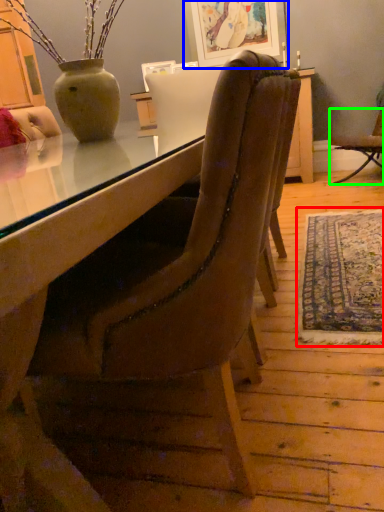
Question: Which object is the farthest from mat (highlighted by a red box)? Choose among these: picture frame (highlighted by a blue box) or chair (highlighted by a green box).

Choices:
 (A) picture frame
 (B) chair

Answer: (A)